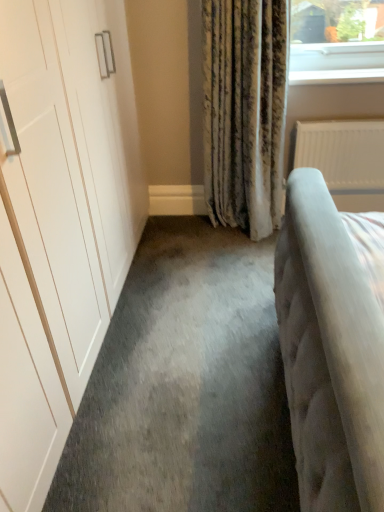
Question: From the image's perspective, is white glossy window sill at upper right above or below white textured radiator at right?

Choices:
 (A) below
 (B) above

Answer: (B)

Question: Considering the positions of white glossy window sill at upper right and white textured radiator at right in the image, is white glossy window sill at upper right taller or shorter than white textured radiator at right?

Choices:
 (A) short
 (B) tall

Answer: (A)

Question: Considering the positions of white glossy window sill at upper right and white textured radiator at right in the image, is white glossy window sill at upper right wider or thinner than white textured radiator at right?

Choices:
 (A) wide
 (B) thin

Answer: (A)

Question: From the image's perspective, is white textured radiator at right located above or below white glossy window sill at upper right?

Choices:
 (A) below
 (B) above

Answer: (A)

Question: Visually, is white textured radiator at right positioned to the left or to the right of white glossy window sill at upper right?

Choices:
 (A) right
 (B) left

Answer: (A)

Question: Considering their positions, is white textured radiator at right located in front of or behind white glossy window sill at upper right?

Choices:
 (A) front
 (B) behind

Answer: (B)

Question: In terms of size, does white textured radiator at right appear bigger or smaller than white glossy window sill at upper right?

Choices:
 (A) big
 (B) small

Answer: (A)